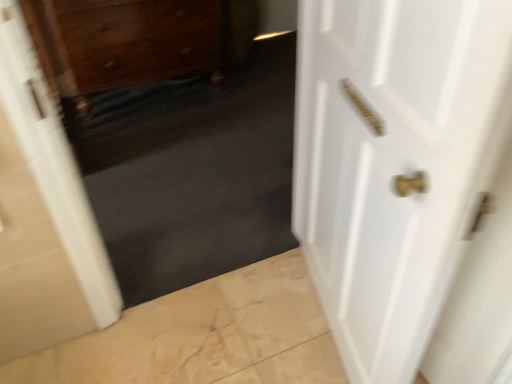
Looking at this image, what is the approximate width of dark matte carpet at center?

The width of dark matte carpet at center is 7.68 inches.

Locate an element on the screen. white glossy door at right is located at coordinates (408, 183).

Which object is wider, wooden drawer at upper left or dark matte carpet at center?

Wider between the two is wooden drawer at upper left.

From a real-world perspective, which object rests below the other?

From a 3D spatial view, wooden drawer at upper left is below.

Is white glossy door at right looking in the opposite direction of wooden drawer at upper left?

No, wooden drawer at upper left is not at the back of white glossy door at right.

From the image's perspective, is white glossy door at right above or below wooden drawer at upper left?

From the image's perspective, white glossy door at right appears below wooden drawer at upper left.

Is white glossy door at right touching wooden drawer at upper left?

They are not placed beside each other.

Which of these two, white glossy door at right or wooden drawer at upper left, stands shorter?

With less height is wooden drawer at upper left.

Is dark matte carpet at center facing towards white glossy door at right?

Yes, dark matte carpet at center is facing white glossy door at right.

Based on the photo, considering the relative positions of dark matte carpet at center and white glossy door at right in the image provided, is dark matte carpet at center in front of white glossy door at right?

No, dark matte carpet at center is further to the viewer.

Is the surface of dark matte carpet at center in direct contact with white glossy door at right?

dark matte carpet at center is not next to white glossy door at right, and they're not touching.

Looking at this image, from a real-world perspective, is dark matte carpet at center physically located above or below white glossy door at right?

dark matte carpet at center is situated higher than white glossy door at right in the real world.

Is white glossy door at right at the back of wooden drawer at upper left?

No, wooden drawer at upper left is not facing the opposite direction of white glossy door at right.

Which object is closer to the camera, wooden drawer at upper left or white glossy door at right?

white glossy door at right.

From the image's perspective, is wooden drawer at upper left above white glossy door at right?

Yes, from the image's perspective, wooden drawer at upper left is over white glossy door at right.

Can you see wooden drawer at upper left touching white glossy door at right?

No, wooden drawer at upper left is not next to white glossy door at right.

Considering the sizes of objects white glossy door at right and dark matte carpet at center in the image provided, who is shorter, white glossy door at right or dark matte carpet at center?

white glossy door at right is shorter.

Are white glossy door at right and dark matte carpet at center beside each other?

They are not placed beside each other.

From a real-world perspective, does white glossy door at right stand above dark matte carpet at center?

No, from a real-world perspective, white glossy door at right is not on top of dark matte carpet at center.

Is white glossy door at right smaller than dark matte carpet at center?

Correct, white glossy door at right occupies less space than dark matte carpet at center.

Can you confirm if dark matte carpet at center is thinner than wooden drawer at upper left?

Yes, dark matte carpet at center is thinner than wooden drawer at upper left.

Is dark matte carpet at center next to wooden drawer at upper left?

dark matte carpet at center is not next to wooden drawer at upper left, and they're not touching.

Which is less distant, (217,127) or (132,68)?

Clearly, point (217,127) is more distant from the camera than point (132,68).

Locate an element on the screen. dark below the wooden drawer at upper left (from the image's perspective) is located at coordinates (192, 172).

The image size is (512, 384). Identify the location of drawer on the left of the white glossy door at right. (134, 40).

Based on their spatial positions, is wooden drawer at upper left or white glossy door at right further from dark matte carpet at center?

white glossy door at right is positioned further to the anchor dark matte carpet at center.

Looking at the image, which one is located further to wooden drawer at upper left, dark matte carpet at center or white glossy door at right?

The object further to wooden drawer at upper left is white glossy door at right.

From the image, which object appears to be nearer to white glossy door at right, dark matte carpet at center or wooden drawer at upper left?

dark matte carpet at center.

Considering their positions, is white glossy door at right positioned further to dark matte carpet at center than wooden drawer at upper left?

white glossy door at right is positioned further to the anchor dark matte carpet at center.

When comparing their distances from white glossy door at right, does wooden drawer at upper left or dark matte carpet at center seem closer?

dark matte carpet at center.

Looking at the image, which one is located further to wooden drawer at upper left, white glossy door at right or dark matte carpet at center?

white glossy door at right is further to wooden drawer at upper left.

Find the location of a particular element. dark positioned between white glossy door at right and wooden drawer at upper left from near to far is located at coordinates (192, 172).